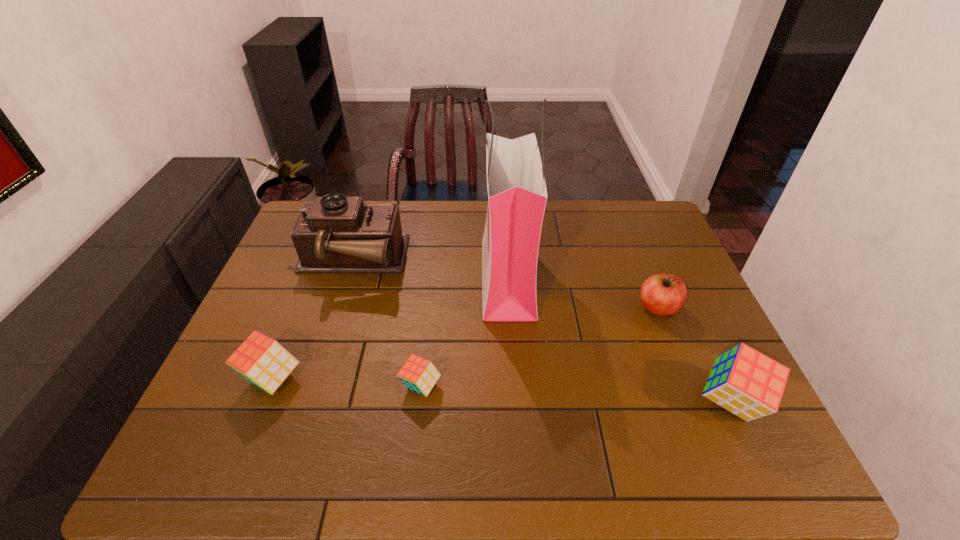
Please point a space for a new cube to maintain equal intervals. Please provide its 2D coordinates. Your answer should be formatted as a tuple, i.e. [(x, y)], where the tuple contains the x and y coordinates of a point satisfying the conditions above.

[(574, 393)]